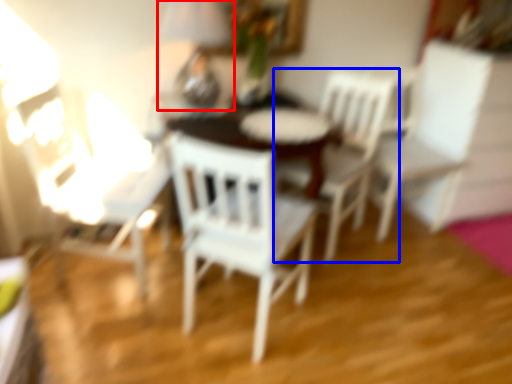
Question: Among these objects, which one is farthest to the camera, table lamp (highlighted by a red box) or chair (highlighted by a blue box)?

Choices:
 (A) table lamp
 (B) chair

Answer: (B)